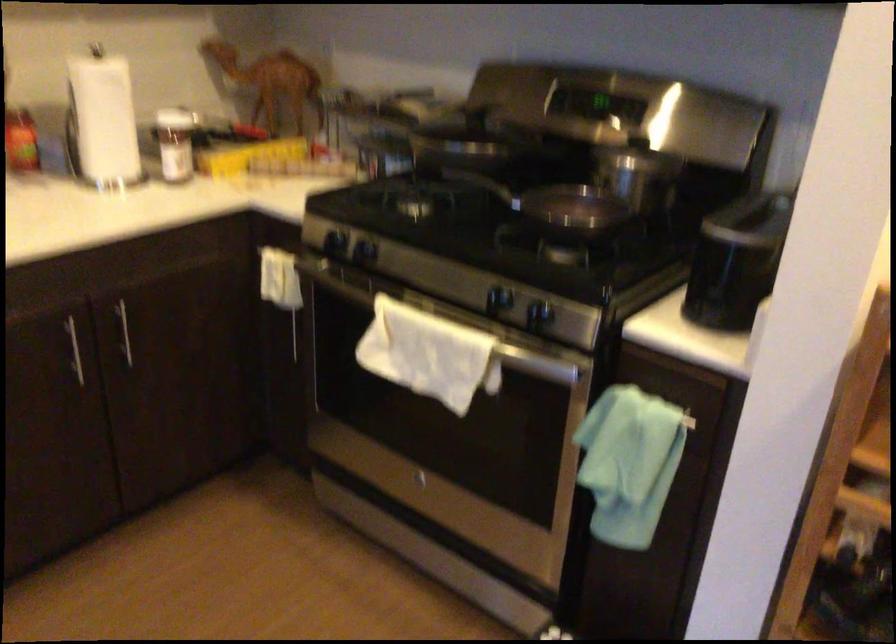
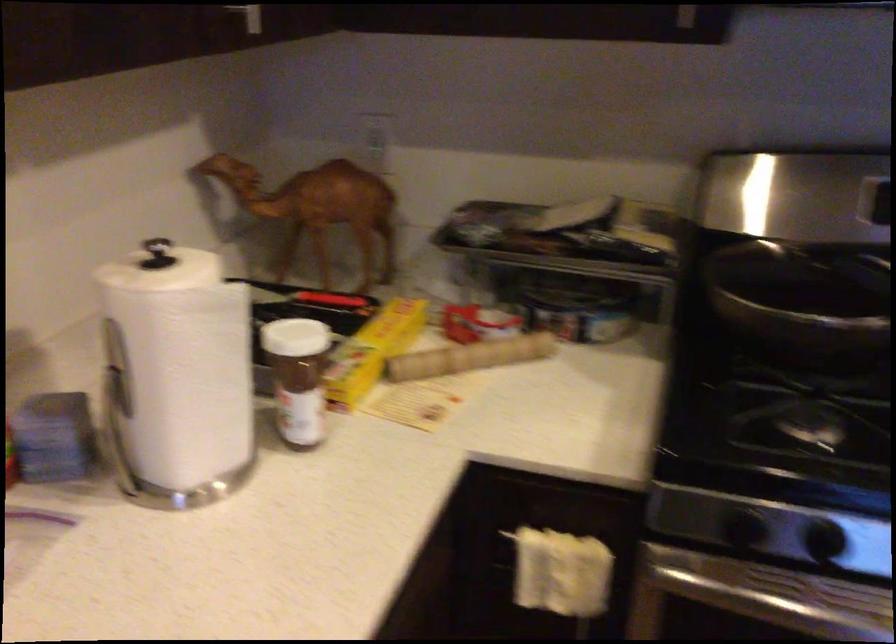
Locate, in the second image, the point that corresponds to [260,77] in the first image.

(317, 210)